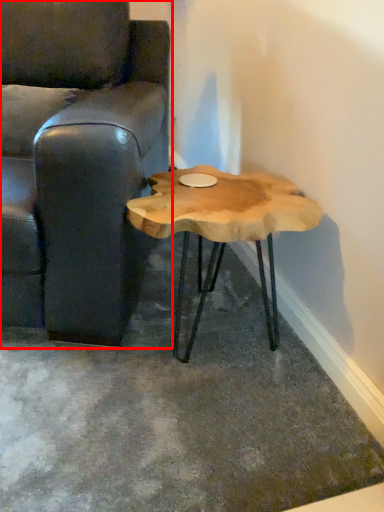
Question: From the image's perspective, what is the correct spatial positioning of chair (annotated by the red box) in reference to coffee table?

Choices:
 (A) above
 (B) below

Answer: (A)